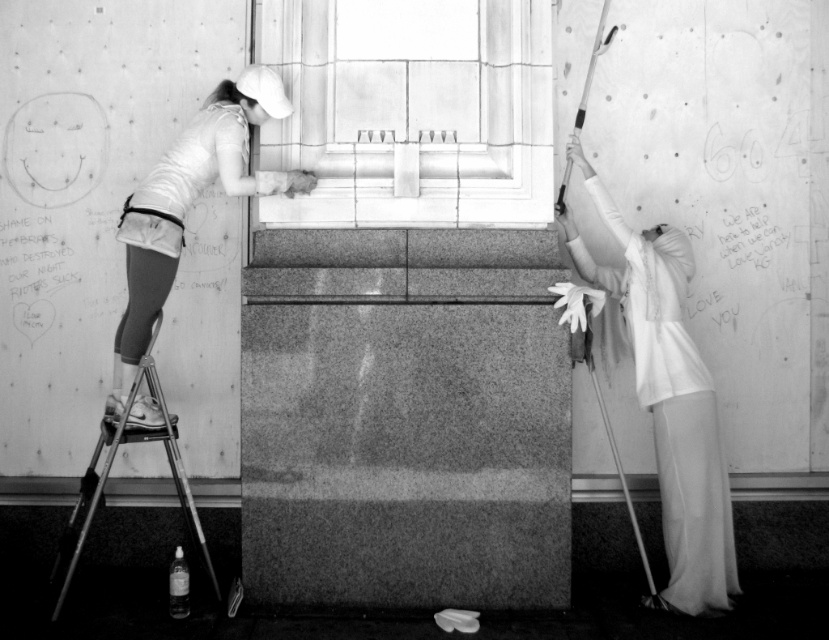
Is smooth stone window at center smaller than white cotton shirt at right?

Indeed, smooth stone window at center has a smaller size compared to white cotton shirt at right.

Does point (507, 172) lie in front of point (701, 472)?

No, (507, 172) is behind (701, 472).

I want to click on smooth stone window at center, so click(x=410, y=112).

Does smooth stone window at center have a lesser height compared to metallic silver ladder at lower left?

Yes, smooth stone window at center is shorter than metallic silver ladder at lower left.

Is smooth stone window at center taller than metallic silver ladder at lower left?

No.

Is point (354, 99) behind point (188, 493)?

Yes.

At what (x,y) coordinates should I click in order to perform the action: click on smooth stone window at center. Please return your answer as a coordinate pair (x, y). The width and height of the screenshot is (829, 640). Looking at the image, I should click on tap(410, 112).

Is white cotton shirt at right below metallic silver ladder at lower left?

No, white cotton shirt at right is not below metallic silver ladder at lower left.

Does white cotton shirt at right lie in front of metallic silver ladder at lower left?

No, it is behind metallic silver ladder at lower left.

Is point (720, 545) more distant than point (188, 524)?

That is False.

Find the location of a particular element. Image resolution: width=829 pixels, height=640 pixels. white cotton shirt at right is located at coordinates (668, 397).